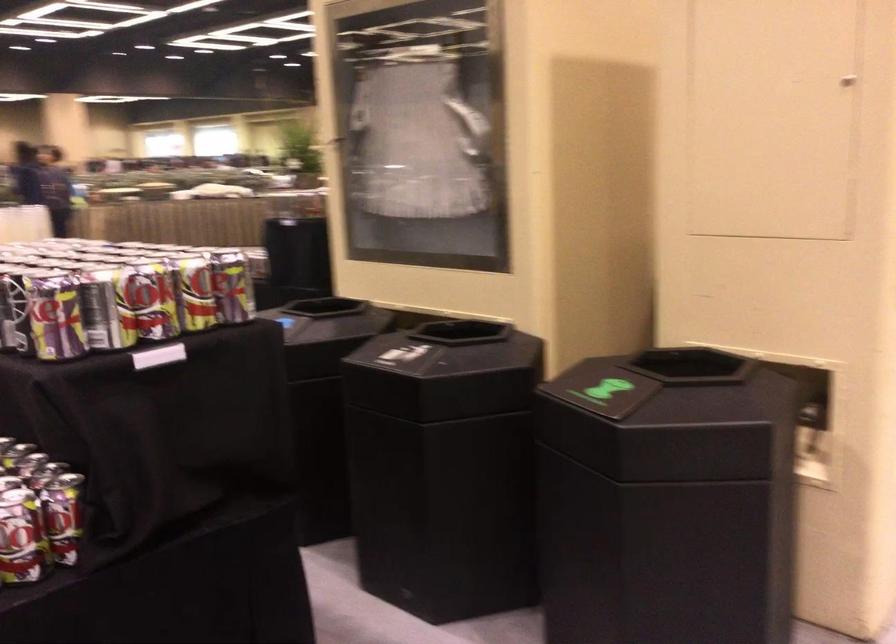
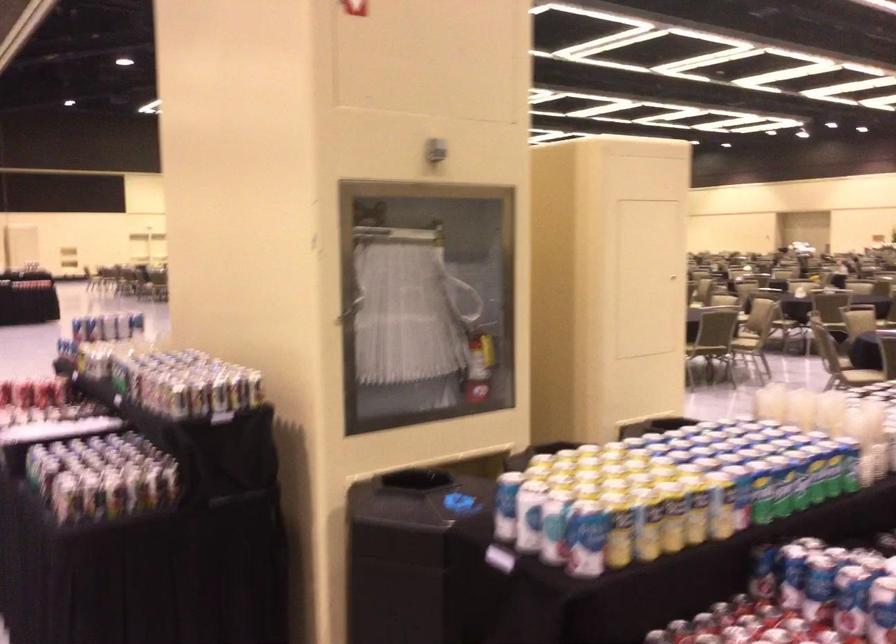
Question: I am providing you with two images of the same scene from different viewpoints. After the viewpoint changes to image2, which objects are now occluded?

Choices:
 (A) trash can opening
 (B) small beverage bottle
 (C) chair sitting surface
 (D) none of these

Answer: (D)